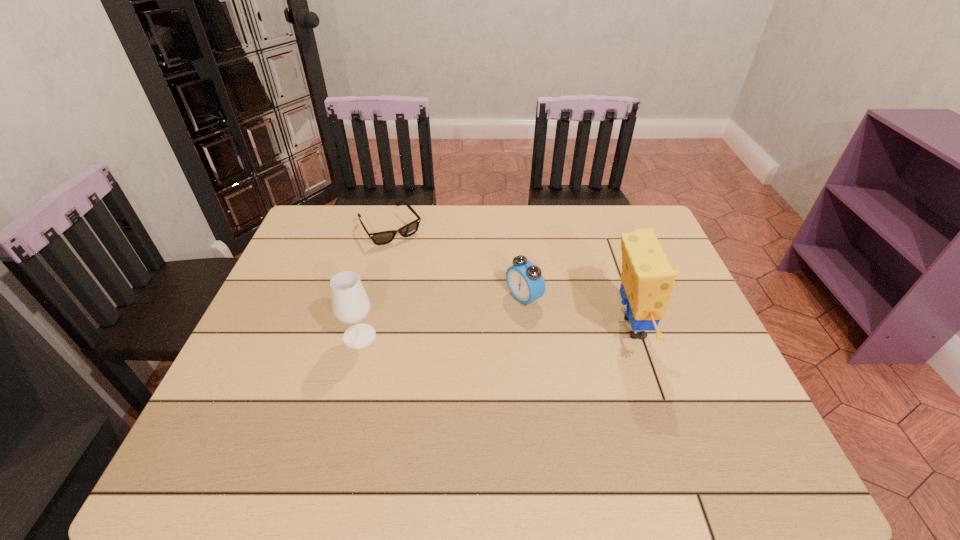
The width and height of the screenshot is (960, 540). What are the coordinates of `the third shortest object` in the screenshot? It's located at (350, 304).

In order to click on sponge in this screenshot , I will do `click(647, 277)`.

You are a GUI agent. You are given a task and a screenshot of the screen. Output one action in this format:
    pyautogui.click(x=<x>, y=<y>)
    Task: Click on the rightmost object
    This screenshot has height=540, width=960.
    Given the screenshot: What is the action you would take?
    pyautogui.click(x=647, y=277)

I want to click on the shortest object, so tap(379, 238).

Where is `sunglasses`? The image size is (960, 540). sunglasses is located at coordinates (379, 238).

This screenshot has width=960, height=540. I want to click on the third object from left to right, so click(x=524, y=279).

Identify the location of alarm clock. This screenshot has height=540, width=960. (524, 279).

Where is `free spot located on the back of the third shortest object`? This screenshot has height=540, width=960. free spot located on the back of the third shortest object is located at coordinates (369, 301).

Find the location of `free space located on the front-facing side of the farthest object`. free space located on the front-facing side of the farthest object is located at coordinates (440, 295).

Locate an element on the screen. blank area located on the front-facing side of the farthest object is located at coordinates (458, 318).